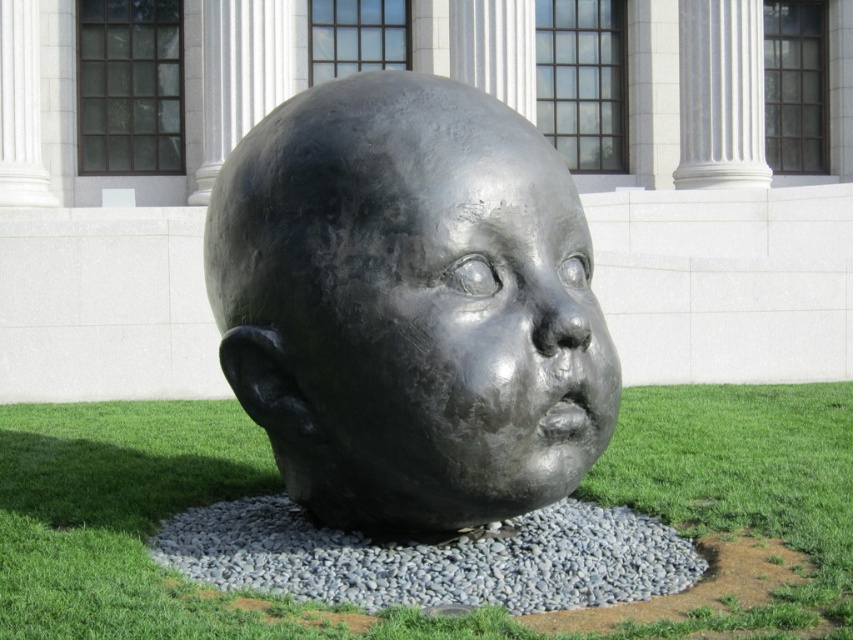
Does black polished stone head at center have a larger size compared to shiny black face at center?

Yes, black polished stone head at center is bigger than shiny black face at center.

Is point (572, 250) farther from viewer compared to point (558, 198)?

Yes.

Find the location of `black polished stone head at center`. black polished stone head at center is located at coordinates (409, 305).

Consider the image. Who is higher up, green grass at center or shiny black face at center?

shiny black face at center is above.

You are a GUI agent. You are given a task and a screenshot of the screen. Output one action in this format:
    pyautogui.click(x=<x>, y=<y>)
    Task: Click on the green grass at center
    This screenshot has width=853, height=640.
    Given the screenshot: What is the action you would take?
    pyautogui.click(x=119, y=516)

This screenshot has width=853, height=640. Identify the location of green grass at center. (119, 516).

Which is in front, point (358, 196) or point (688, 22)?

Point (358, 196) is more forward.

Find the location of a particular element. Image resolution: width=853 pixels, height=640 pixels. black polished stone head at center is located at coordinates (409, 305).